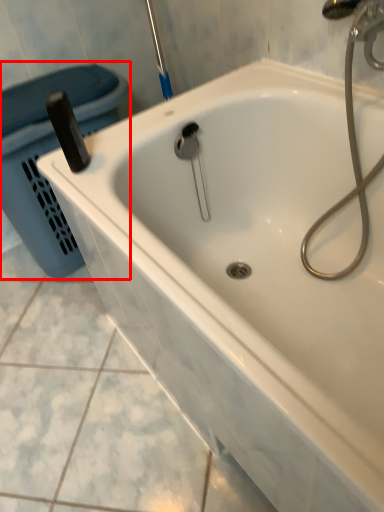
Question: From the image's perspective, considering the relative positions of laundry basket (annotated by the red box) and plumbing fixture in the image provided, where is laundry basket (annotated by the red box) located with respect to the staircase?

Choices:
 (A) below
 (B) above

Answer: (B)